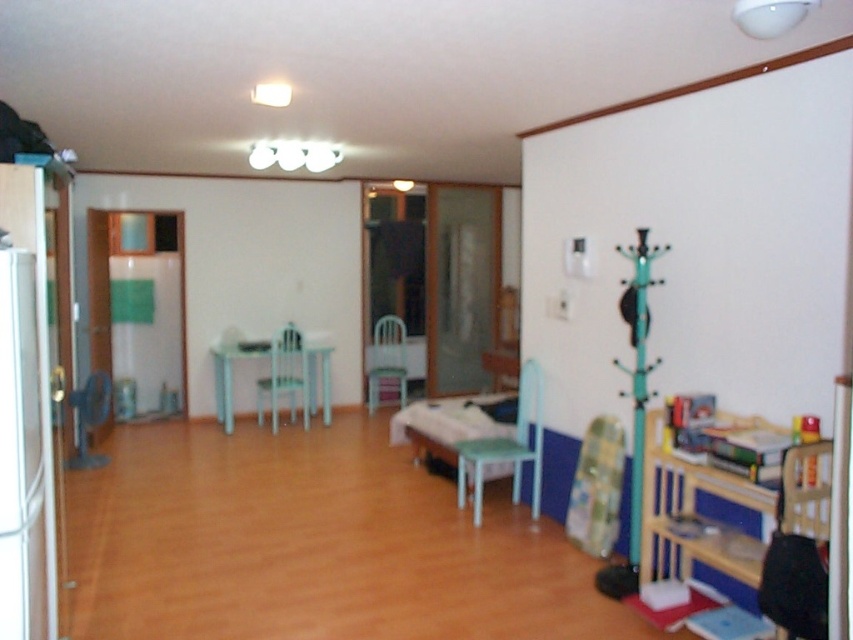
Question: Which object is positioned closest to the green matte chair at center?

Choices:
 (A) matte plastic chair at center
 (B) wooden bookshelf at right

Answer: (A)

Question: Is wooden bookshelf at right below light blue plastic chair at center?

Choices:
 (A) no
 (B) yes

Answer: (B)

Question: Is wooden bookshelf at right smaller than green matte chair at center?

Choices:
 (A) yes
 (B) no

Answer: (B)

Question: Estimate the real-world distances between objects in this image. Which object is farther from the green matte chair at center?

Choices:
 (A) matte plastic chair at center
 (B) light blue plastic chair at center
 (C) black fabric chair at lower right

Answer: (C)

Question: Can you confirm if wooden bookshelf at right is positioned to the right of light blue plastic chair at center?

Choices:
 (A) no
 (B) yes

Answer: (B)

Question: Which object appears closest to the camera in this image?

Choices:
 (A) wooden bookshelf at right
 (B) green matte chair at center
 (C) black fabric chair at lower right

Answer: (C)